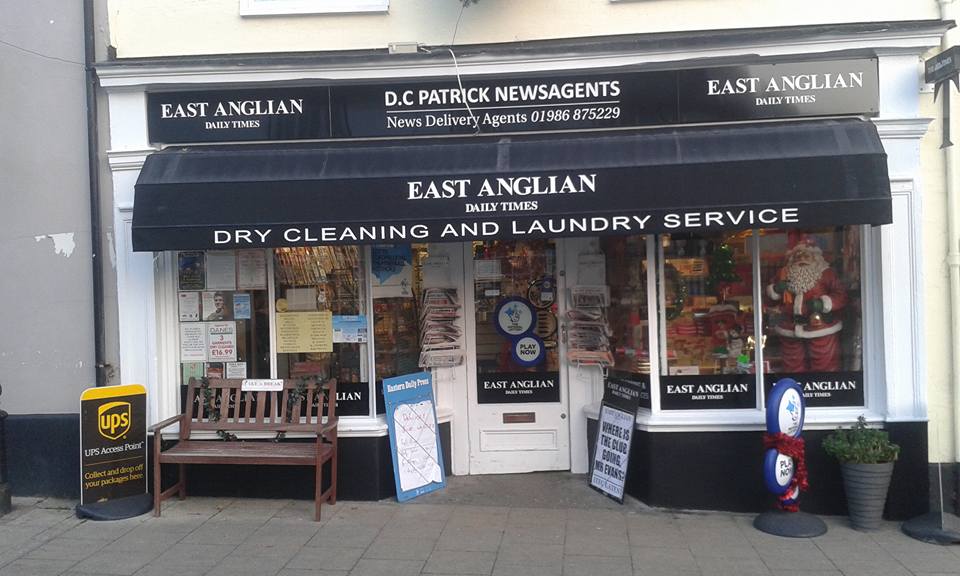
Identify the location of arm rest on end of bench. click(x=168, y=422), click(x=324, y=424).